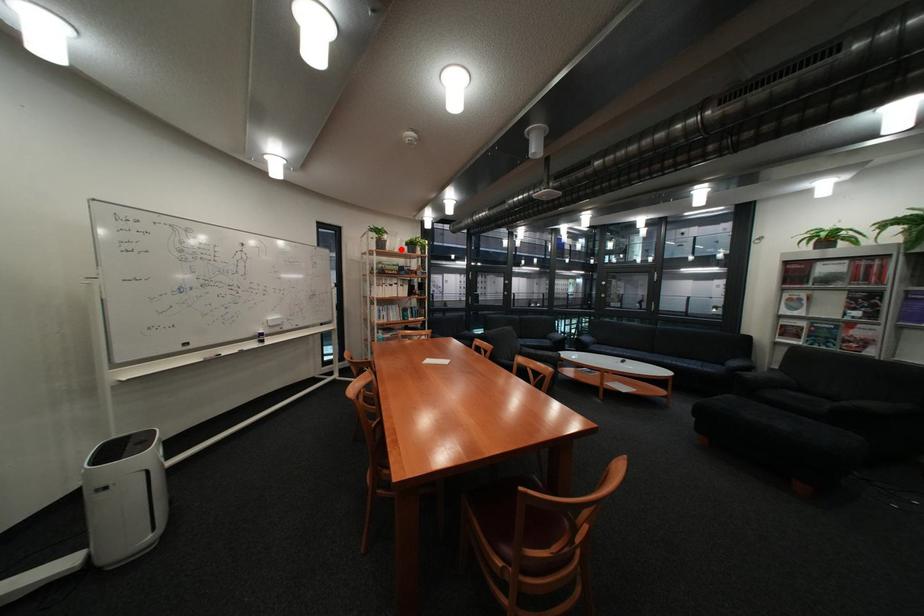
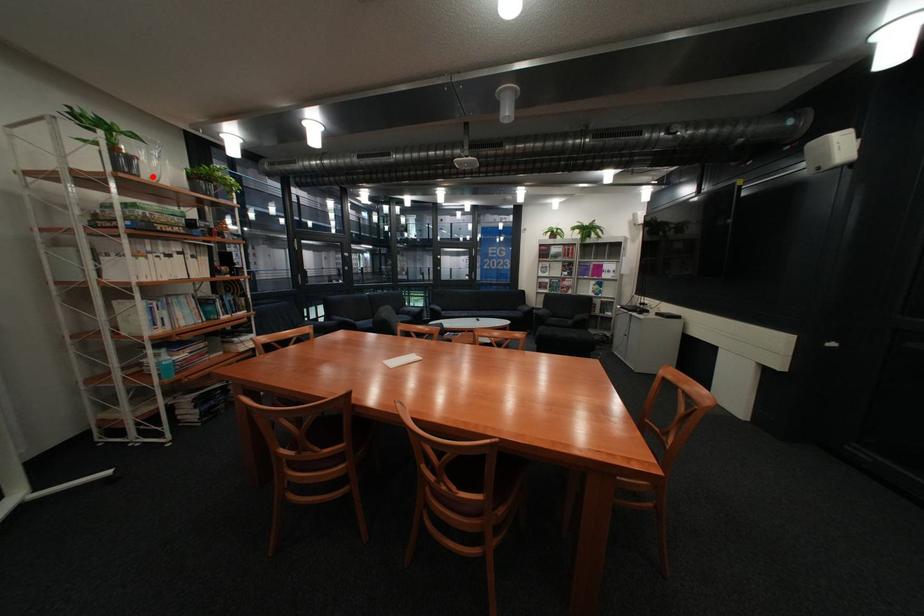
I am providing you with two images of the same scene from different viewpoints. A red point is marked on the first image and another point is marked on the second image. Are the points marked in image1 and image2 representing the same 3D position?

Yes